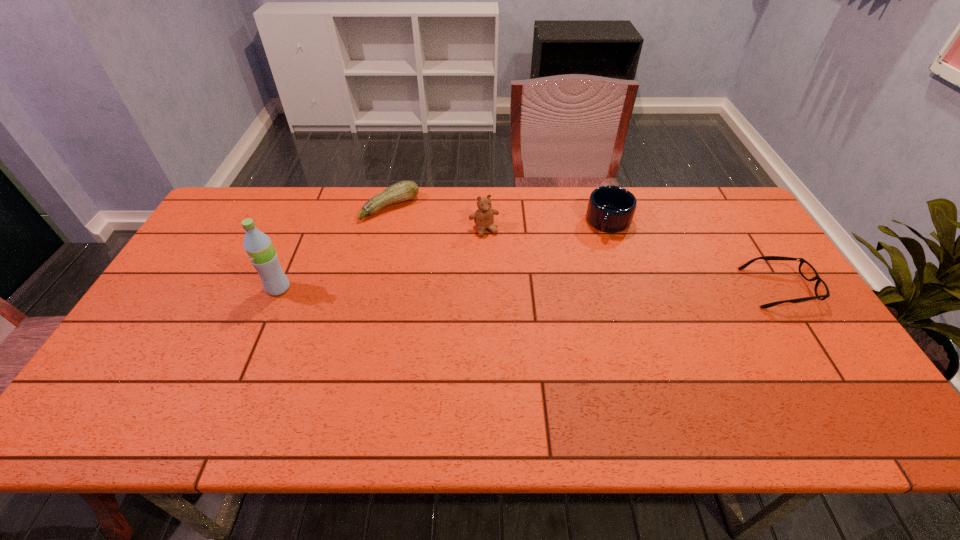
What are the coordinates of `vacant position located 0.220m on the back of the water bottle` in the screenshot? It's located at (303, 230).

This screenshot has width=960, height=540. I want to click on vacant area situated 0.120m on the face of the teddy bear, so click(500, 263).

What are the coordinates of `vacant space located on the face of the teddy bear` in the screenshot? It's located at (500, 263).

You are a GUI agent. You are given a task and a screenshot of the screen. Output one action in this format:
    pyautogui.click(x=<x>, y=<y>)
    Task: Click on the free space located 0.170m on the face of the teddy bear
    
    Given the screenshot: What is the action you would take?
    pyautogui.click(x=506, y=275)

Identify the location of vacant area located 0.290m at the stem end of the zucchini. (455, 269).

I want to click on free location located 0.200m at the stem end of the zucchini, so click(x=438, y=253).

Where is `vacant point located at the stem end of the zucchini`? This screenshot has height=540, width=960. vacant point located at the stem end of the zucchini is located at coordinates (461, 275).

The width and height of the screenshot is (960, 540). Identify the location of vacant region located 0.230m with the handle on the side of the third shortest object. (585, 286).

The height and width of the screenshot is (540, 960). I want to click on blank area located with the handle on the side of the third shortest object, so click(576, 308).

The width and height of the screenshot is (960, 540). I want to click on vacant space located 0.120m with the handle on the side of the third shortest object, so click(x=594, y=261).